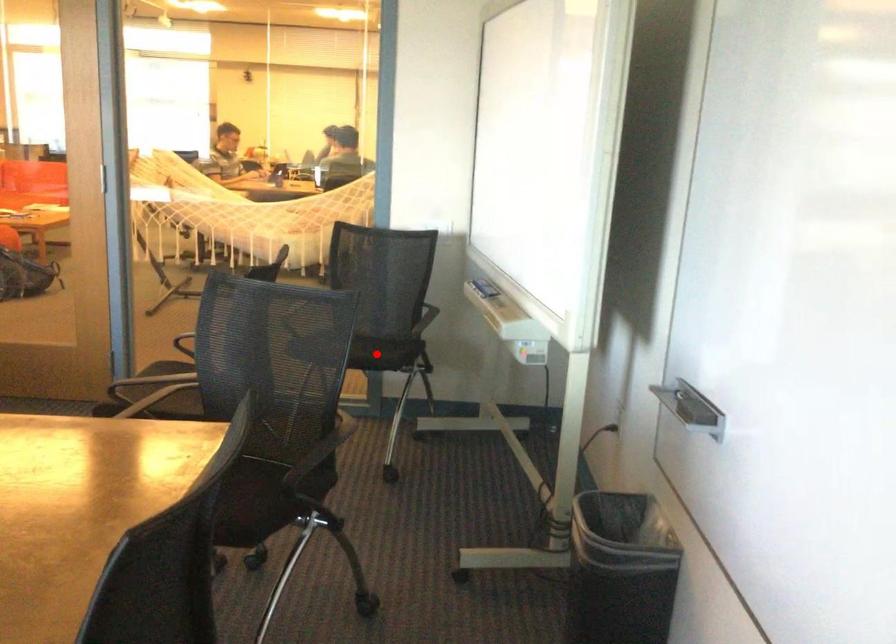
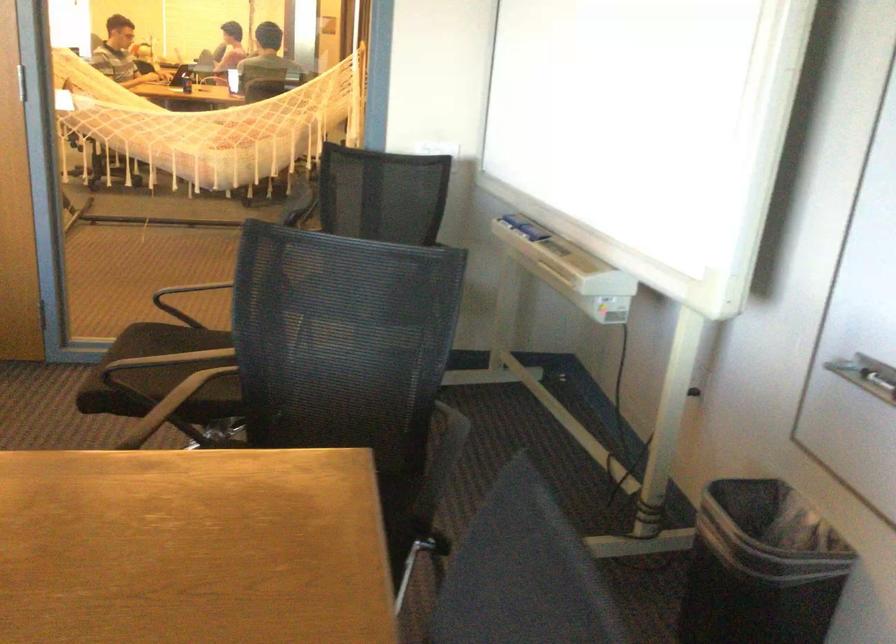
Question: I am providing you with two images of the same scene from different viewpoints. A red point is marked on the first image. Can you still see the location of the red point in image 2?

Choices:
 (A) Yes
 (B) No

Answer: (B)